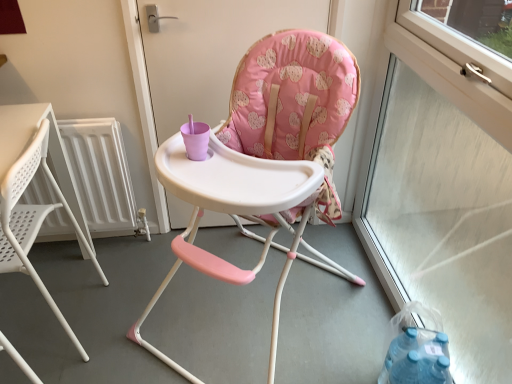
Question: Considering their positions, is white metallic radiator at left located in front of or behind matte plastic highchair at center, which is the 1th chair in right-to-left order?

Choices:
 (A) front
 (B) behind

Answer: (B)

Question: Is white metallic radiator at left wider or thinner than matte plastic highchair at center, the 2th chair from the left?

Choices:
 (A) thin
 (B) wide

Answer: (A)

Question: Considering the real-world distances, which object is farthest from the transparent glass window at right?

Choices:
 (A) white plastic chair at left, the first chair viewed from the left
 (B) white metallic radiator at left
 (C) matte plastic highchair at center, which is the 1th chair in right-to-left order
 (D) pink fabric high chair at center

Answer: (A)

Question: Which object is positioned farthest from the white metallic radiator at left?

Choices:
 (A) pink fabric high chair at center
 (B) matte plastic highchair at center, which is the 1th chair in right-to-left order
 (C) transparent glass window at right
 (D) white plastic chair at left, the first chair viewed from the left

Answer: (C)